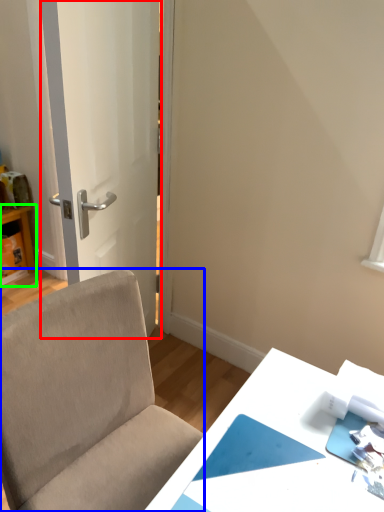
Question: Based on their relative distances, which object is nearer to door (highlighted by a red box)? Choose from chair (highlighted by a blue box) and table (highlighted by a green box).

Choices:
 (A) chair
 (B) table

Answer: (A)